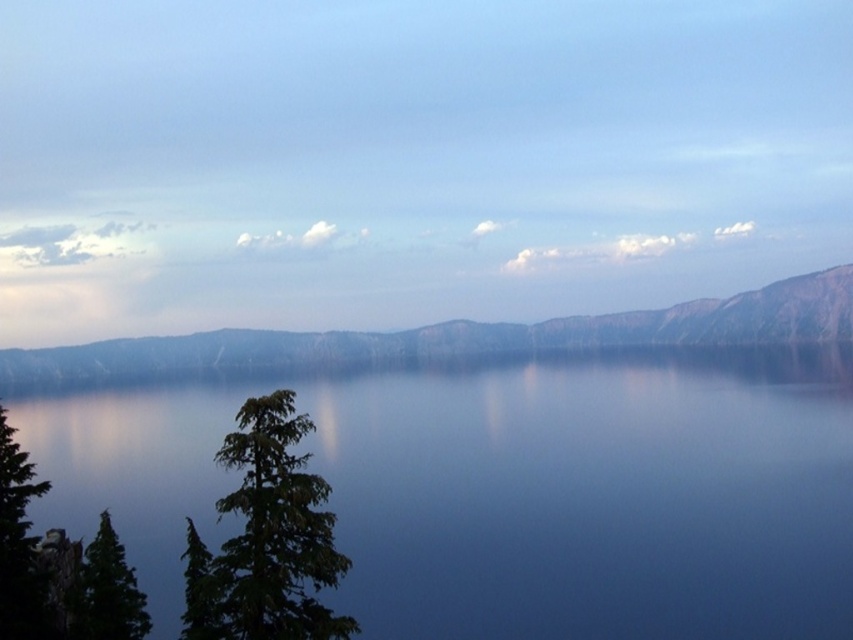
Question: Does rugged stone mountain at upper center have a lesser width compared to green matte tree at lower left?

Choices:
 (A) yes
 (B) no

Answer: (B)

Question: Is green textured tree at left to the right of green matte tree at lower left from the viewer's perspective?

Choices:
 (A) no
 (B) yes

Answer: (B)

Question: Considering the real-world distances, which object is closest to the green textured tree at left?

Choices:
 (A) rugged stone mountain at upper center
 (B) blue reflective water at center

Answer: (B)

Question: Is rugged stone mountain at upper center bigger than green matte tree at lower left?

Choices:
 (A) yes
 (B) no

Answer: (A)

Question: Estimate the real-world distances between objects in this image. Which object is closer to the green matte tree at lower left?

Choices:
 (A) green textured tree at left
 (B) blue reflective water at center
 (C) rugged stone mountain at upper center

Answer: (A)

Question: Which of the following is the farthest from the observer?

Choices:
 (A) (148, 625)
 (B) (277, 406)

Answer: (A)